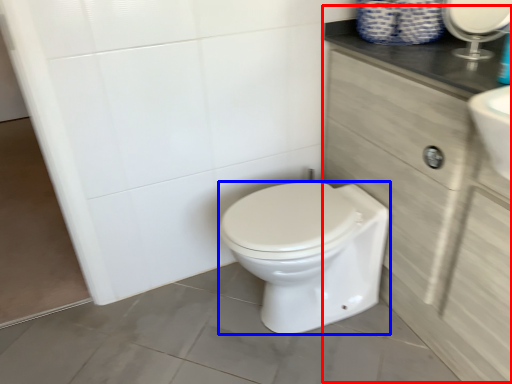
Question: Which object appears closest to the camera in this image, cabinetry (highlighted by a red box) or bidet (highlighted by a blue box)?

Choices:
 (A) cabinetry
 (B) bidet

Answer: (A)